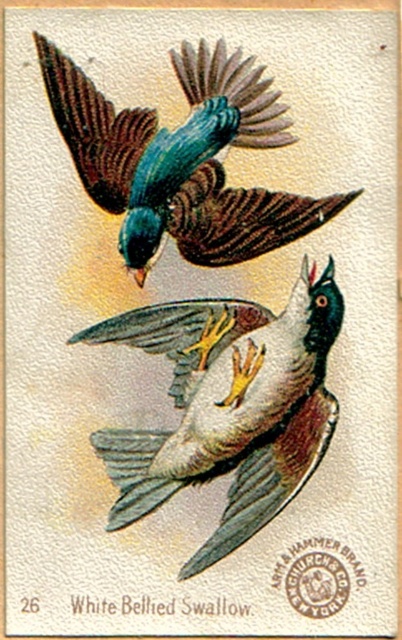
Question: Which object is farther from the camera taking this photo?

Choices:
 (A) white feathered bird at center
 (B) shiny blue-green bird at upper center

Answer: (A)

Question: Among these objects, which one is nearest to the camera?

Choices:
 (A) shiny blue-green bird at upper center
 (B) white feathered bird at center

Answer: (A)

Question: Does white feathered bird at center appear under shiny blue-green bird at upper center?

Choices:
 (A) no
 (B) yes

Answer: (B)

Question: Is white feathered bird at center below shiny blue-green bird at upper center?

Choices:
 (A) yes
 (B) no

Answer: (A)

Question: Can you confirm if white feathered bird at center is positioned to the right of shiny blue-green bird at upper center?

Choices:
 (A) no
 (B) yes

Answer: (B)